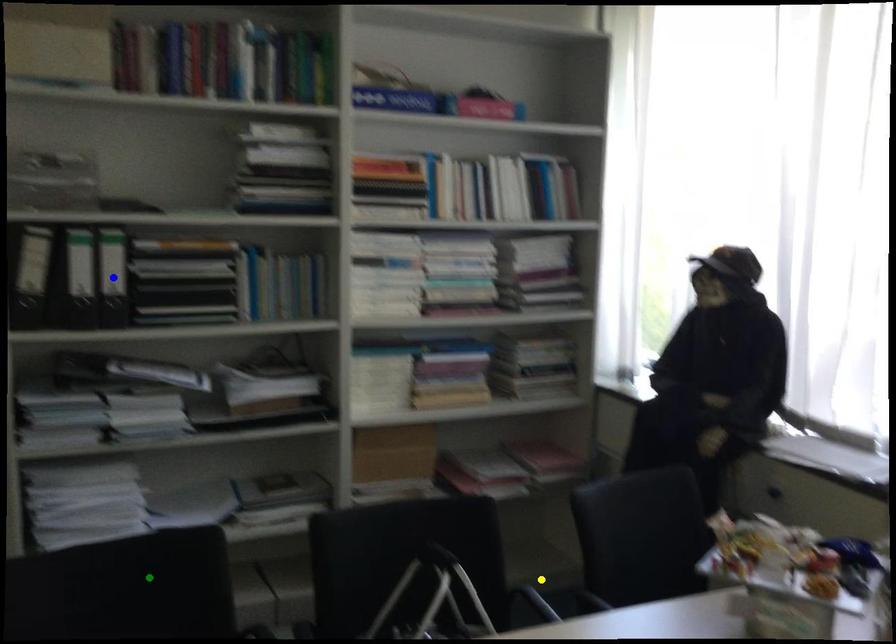
Based on the photo, order these from nearest to farthest:
- green point
- yellow point
- blue point

green point
blue point
yellow point